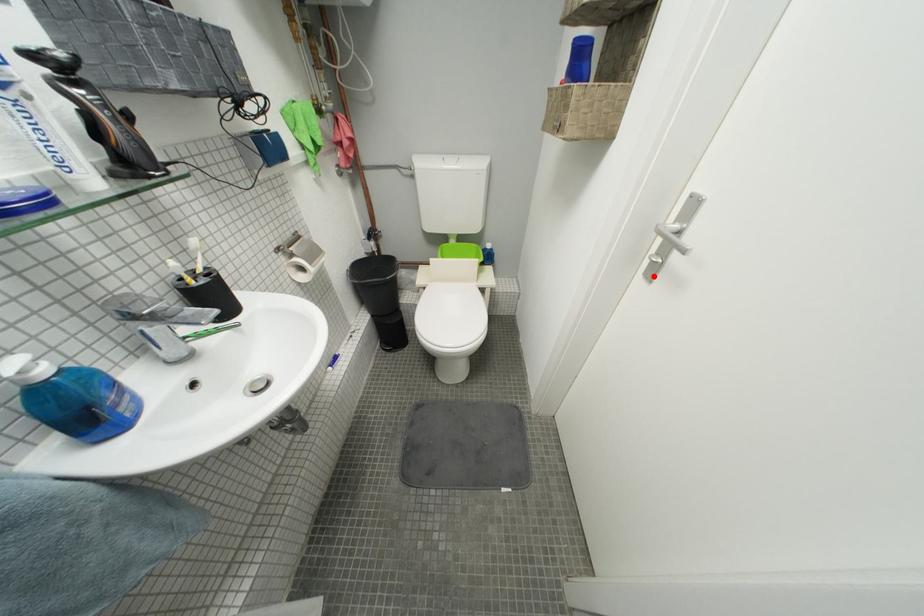
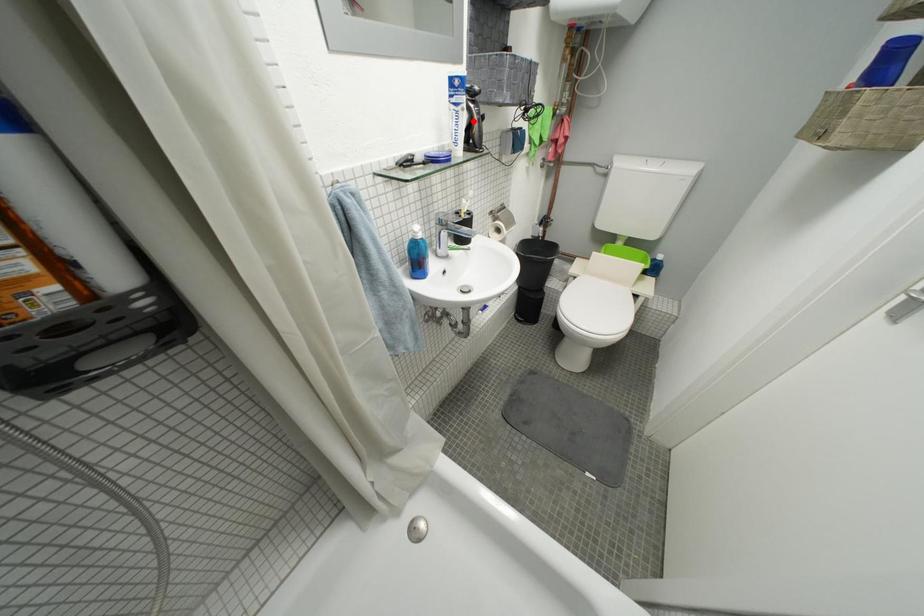
I am providing you with two images of the same scene from different viewpoints. A red point is marked on the first image and another point is marked on the second image. Does the point marked in image1 correspond to the same location as the one in image2?

No